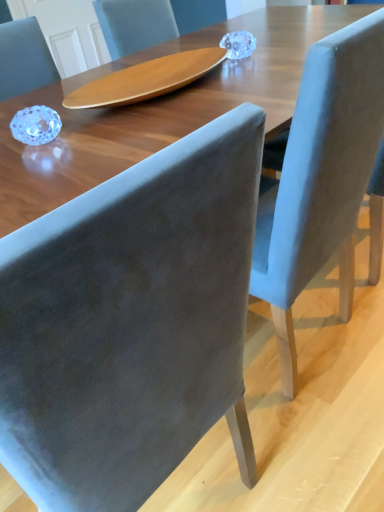
Question: Looking at their shapes, would you say velvet blue chair at center, which ranks as the second chair in left-to-right order, is wider or thinner than velvet gray chair at center, which is the 2th chair in right-to-left order?

Choices:
 (A) thin
 (B) wide

Answer: (A)

Question: Would you say velvet blue chair at center, which ranks as the second chair in left-to-right order, is to the left or to the right of velvet gray chair at center, which is the 2th chair in right-to-left order, in the picture?

Choices:
 (A) right
 (B) left

Answer: (A)

Question: In terms of size, does velvet blue chair at center, marked as the 1th chair in a right-to-left arrangement, appear bigger or smaller than velvet gray chair at center, the 1th chair from the left?

Choices:
 (A) big
 (B) small

Answer: (A)

Question: Considering the relative positions of velvet gray chair at center, the 1th chair from the left, and velvet blue chair at center, which ranks as the second chair in left-to-right order, in the image provided, is velvet gray chair at center, the 1th chair from the left, to the left or to the right of velvet blue chair at center, which ranks as the second chair in left-to-right order,?

Choices:
 (A) right
 (B) left

Answer: (B)

Question: In terms of size, does velvet gray chair at center, the 1th chair from the left, appear bigger or smaller than velvet blue chair at center, marked as the 1th chair in a right-to-left arrangement?

Choices:
 (A) small
 (B) big

Answer: (A)

Question: Considering their positions, is velvet gray chair at center, which is the 2th chair in right-to-left order, located in front of or behind velvet blue chair at center, marked as the 1th chair in a right-to-left arrangement?

Choices:
 (A) front
 (B) behind

Answer: (A)

Question: From a real-world perspective, is velvet gray chair at center, which is the 2th chair in right-to-left order, positioned above or below velvet blue chair at center, which ranks as the second chair in left-to-right order?

Choices:
 (A) below
 (B) above

Answer: (B)